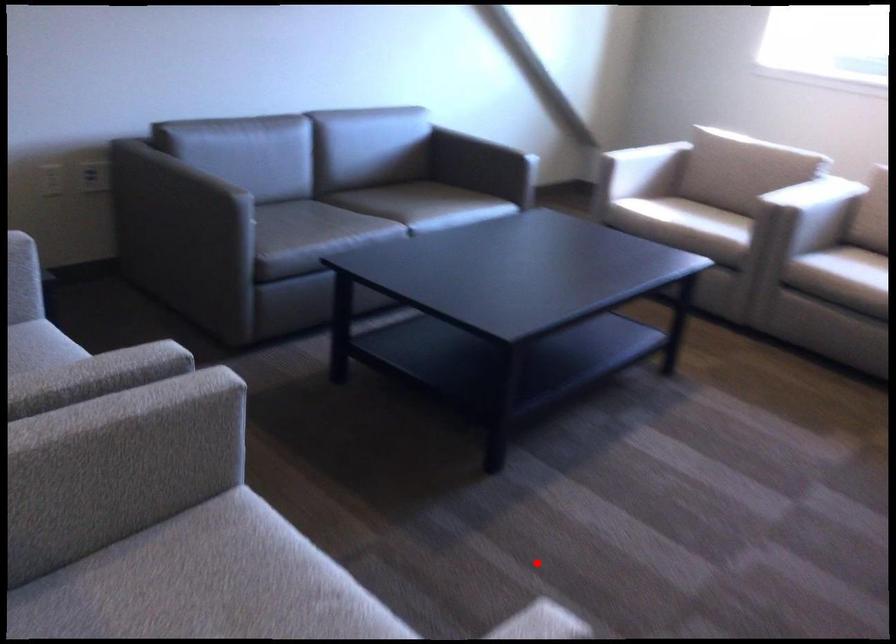
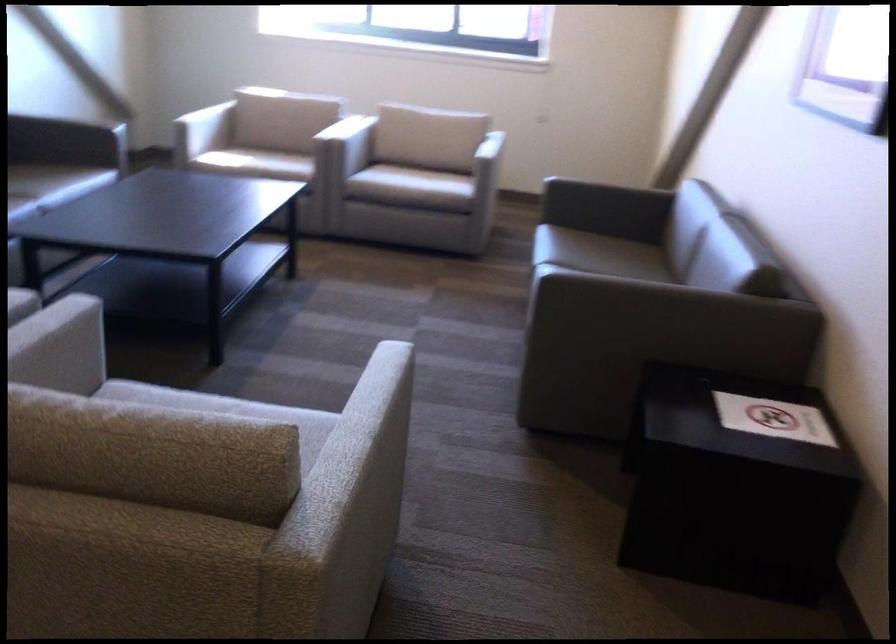
Find the pixel in the second image that matches the highlighted location in the first image.

(279, 406)